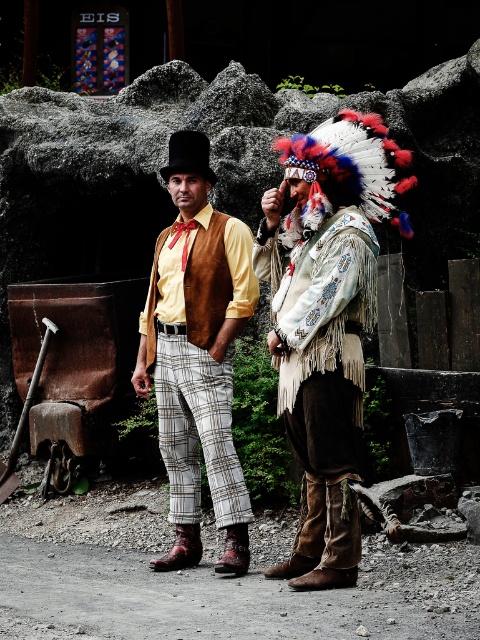
You are a photographer trying to capture a closeup of the matte brown vest at center without including the white fringed leather jacket at center in the frame. Based on their positions, which direction should you move your camera to the left or right?

The white fringed leather jacket at center is to the right of the matte brown vest at center. To avoid including the white fringed leather jacket at center in the frame, move the camera to the right so that it focuses solely on the matte brown vest at center.